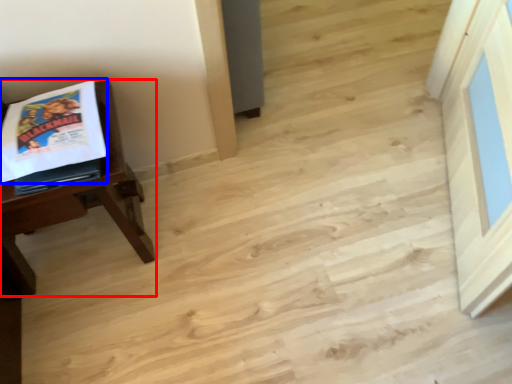
Question: Which object is closer to the camera taking this photo, table (highlighted by a red box) or comic book (highlighted by a blue box)?

Choices:
 (A) table
 (B) comic book

Answer: (A)